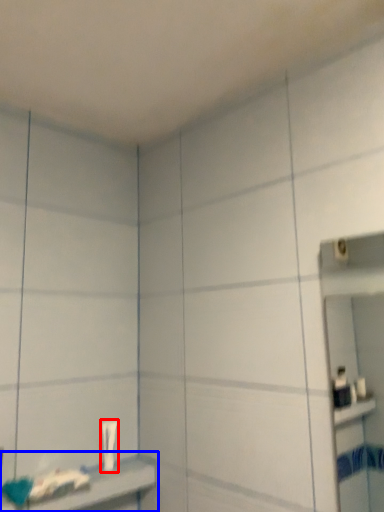
Question: Which object appears closest to the camera in this image, toothpaste (highlighted by a red box) or shelf (highlighted by a blue box)?

Choices:
 (A) toothpaste
 (B) shelf

Answer: (B)